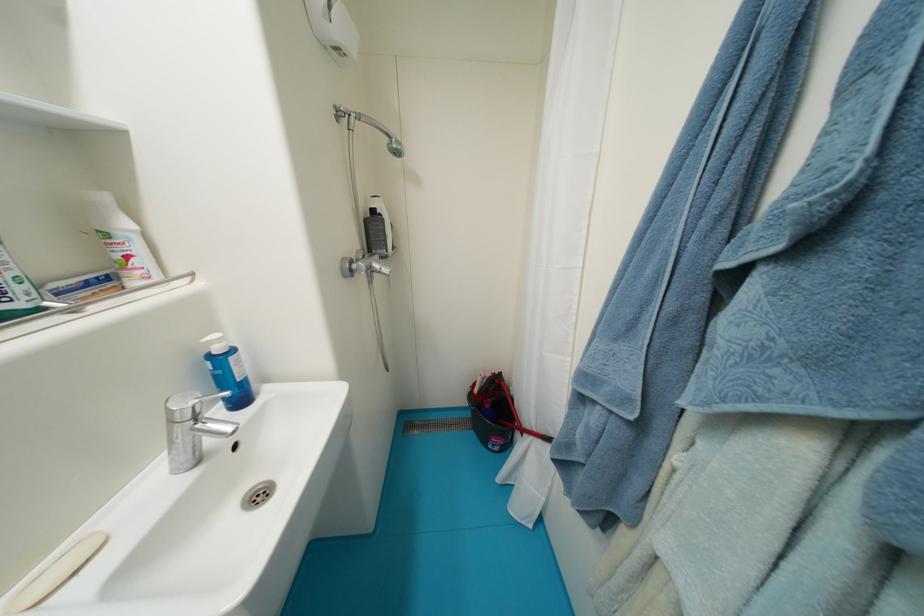
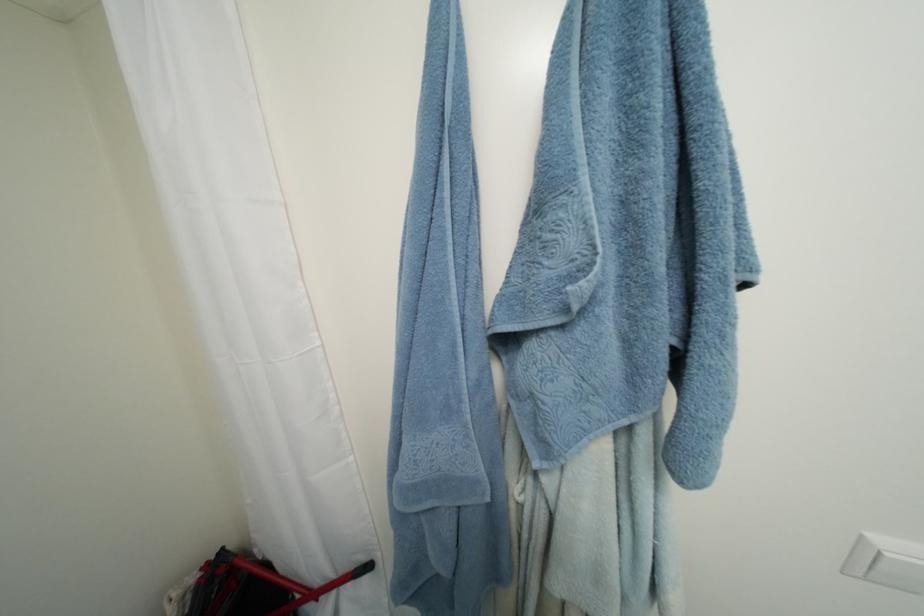
Question: How did the camera likely rotate?

Choices:
 (A) Left
 (B) Right
 (C) Up
 (D) Down

Answer: (B)